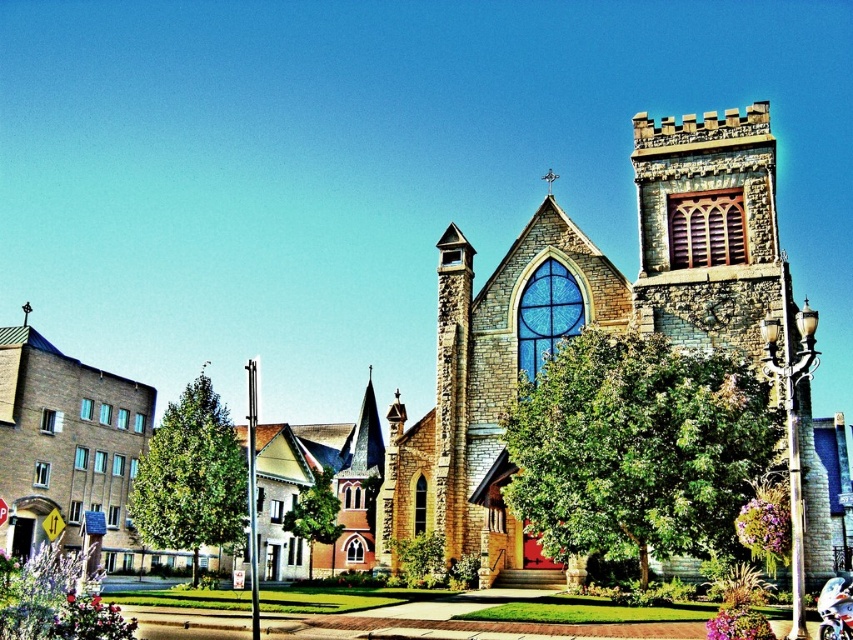
How far apart are stone church at center and metallic blue motorcycle at lower right?

The distance of stone church at center from metallic blue motorcycle at lower right is 22.57 meters.

The width and height of the screenshot is (853, 640). What do you see at coordinates (581, 323) in the screenshot? I see `stone church at center` at bounding box center [581, 323].

Locate an element on the screen. This screenshot has height=640, width=853. stone church at center is located at coordinates pos(581,323).